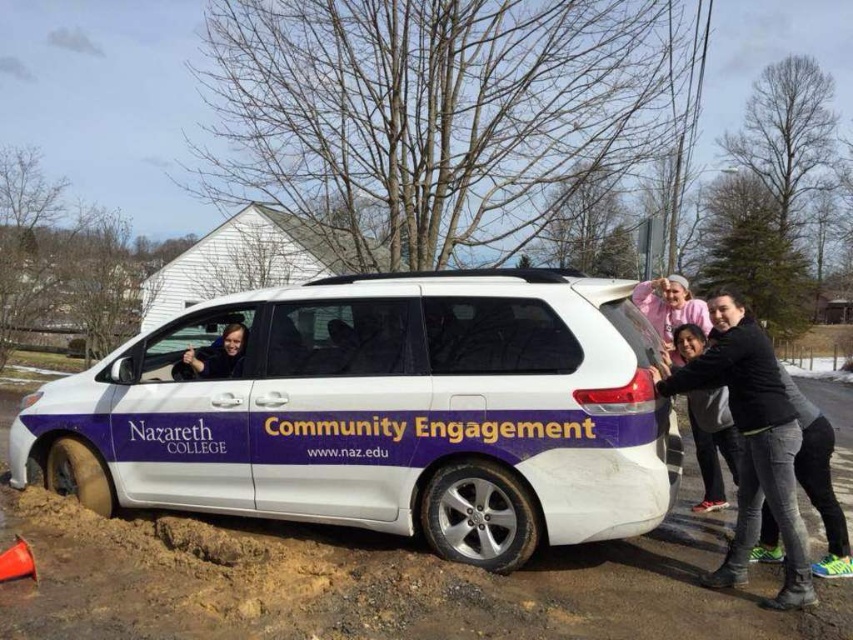
You are a delivery person who needs to place a package on the white matte van at center. The package is 5 feet long. Can you fit the package on the van without it overlapping with the black matte shirt at center?

The white matte van at center and black matte shirt at center are 4.71 feet apart from each other. Since the package is 5 feet long, it would overlap with the black matte shirt at center when placed on the van.

Based on the photo, you are a photographer trying to capture a clear shot of the white matte van at center and the black matte shirt at center. Since you want to ensure both are visible in the frame, which object should you focus on first to account for their sizes?

The white matte van at center is larger than the black matte shirt at center, so you should focus on the white matte van at center first to ensure its details are captured clearly before adjusting for the smaller object.

You are a photographer at the scene and want to capture a clear photo of both the black matte shirt at center and the matte black face at center. Which object should you focus on first to ensure both are in focus?

The black matte shirt at center is closer to the viewer than the matte black face at center. To ensure both are in focus, focus on the black matte shirt at center first, as it is closer, and the matte black face at center will be in focus due to the depth of field extending backward.